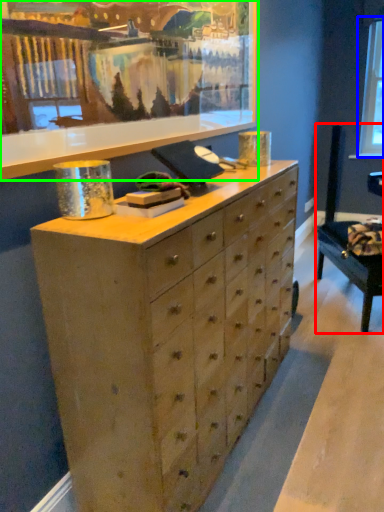
Question: Estimate the real-world distances between objects in this image. Which object is closer to swivel chair (highlighted by a red box), window screen (highlighted by a blue box) or picture frame (highlighted by a green box)?

Choices:
 (A) window screen
 (B) picture frame

Answer: (B)